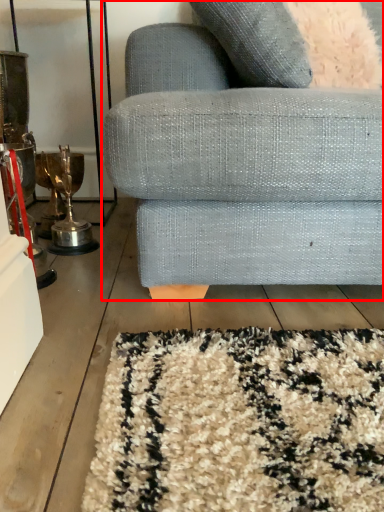
Question: Considering the relative positions of studio couch (annotated by the red box) and throw pillow in the image provided, where is studio couch (annotated by the red box) located with respect to the staircase?

Choices:
 (A) left
 (B) right

Answer: (A)